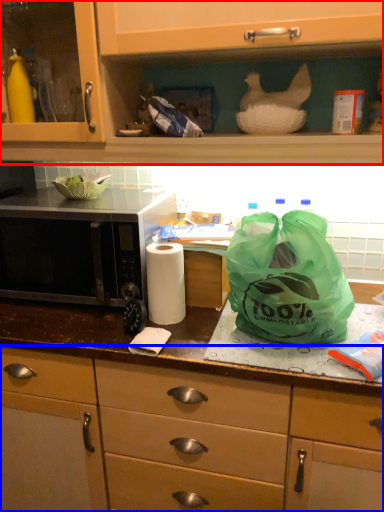
Question: Which object appears farthest to the camera in this image, cabinetry (highlighted by a red box) or cabinetry (highlighted by a blue box)?

Choices:
 (A) cabinetry
 (B) cabinetry

Answer: (B)